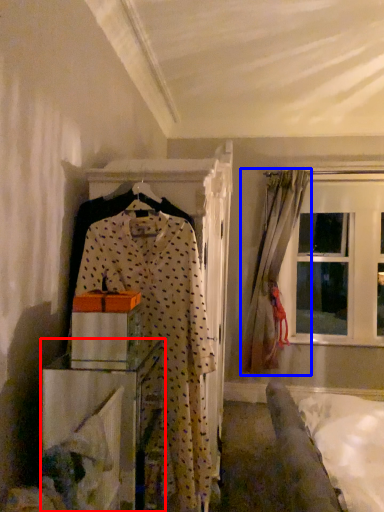
Question: Which point is closer to the camera, furniture (highlighted by a red box) or curtain (highlighted by a blue box)?

Choices:
 (A) furniture
 (B) curtain

Answer: (A)